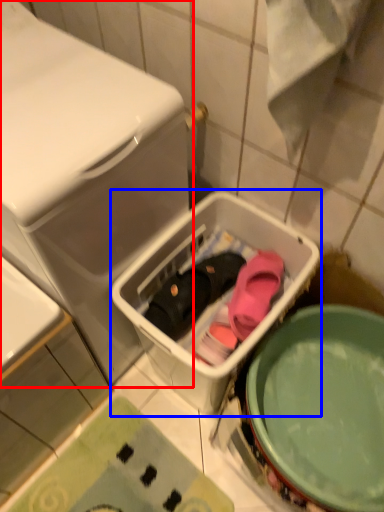
Question: Which object is further to the camera taking this photo, dish washer (highlighted by a red box) or dish washer (highlighted by a blue box)?

Choices:
 (A) dish washer
 (B) dish washer

Answer: (B)